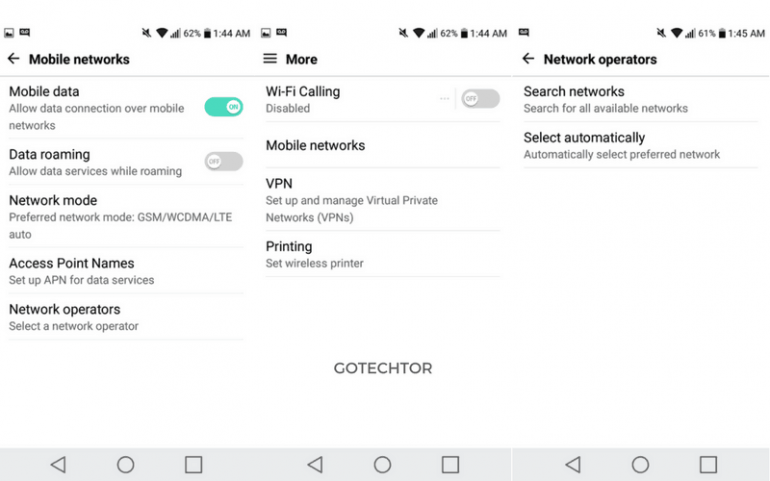
The width and height of the screenshot is (770, 481). Identify the location of toggle switch off. (213, 160), (486, 98).